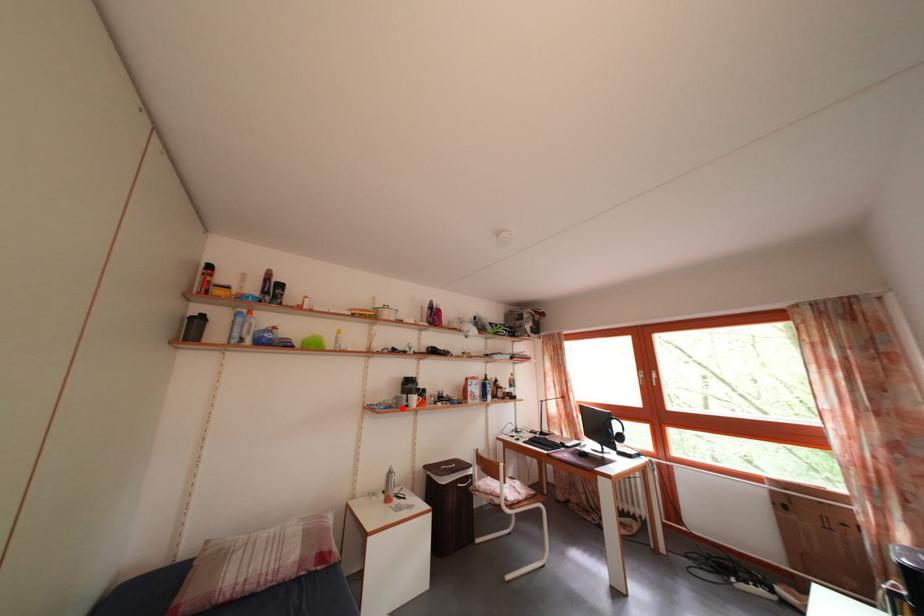
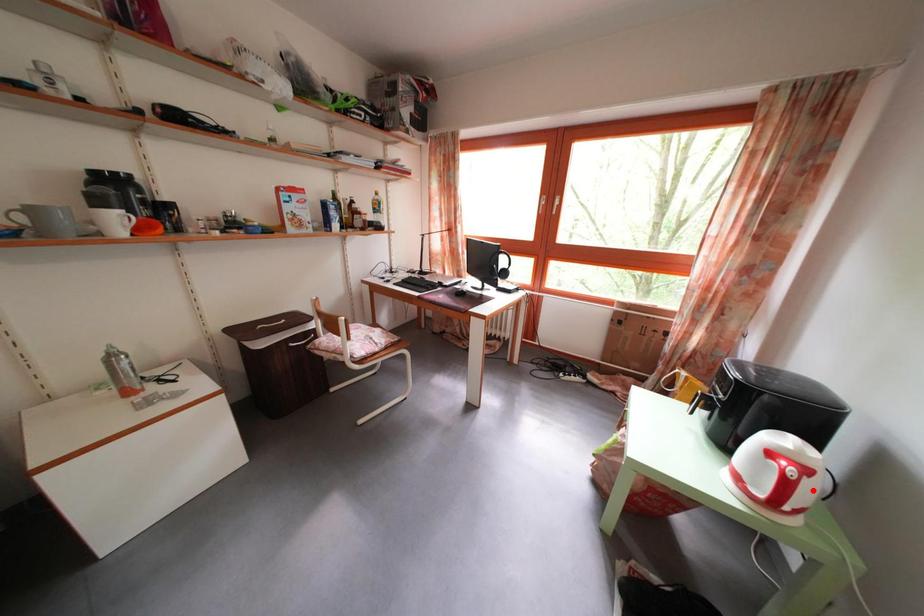
I am providing you with two images of the same scene from different viewpoints. A red point is marked on the first image and another point is marked on the second image. Is the red point in image1 aligned with the point shown in image2?

No